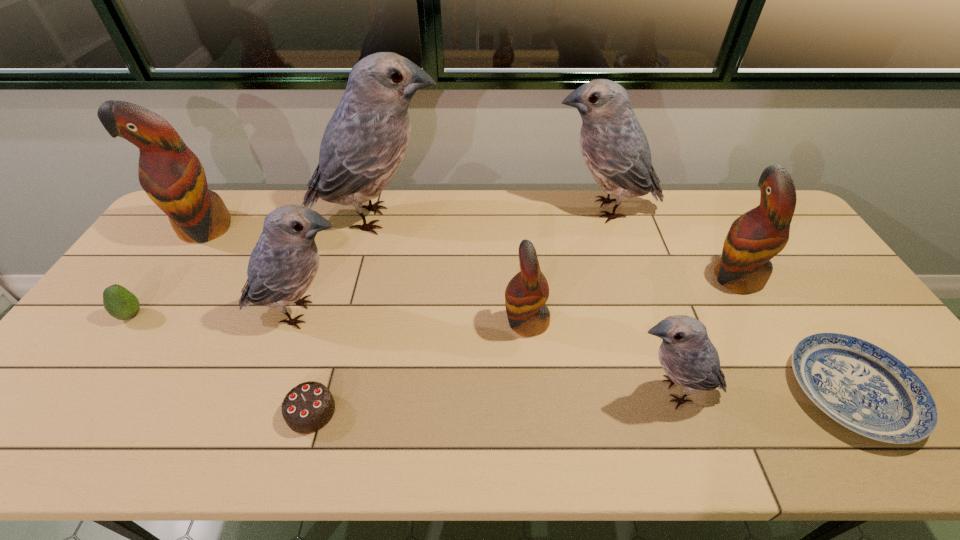
Where is `object located in the right edge section of the desktop`? Image resolution: width=960 pixels, height=540 pixels. object located in the right edge section of the desktop is located at coordinates (861, 386).

At what (x,y) coordinates should I click in order to perform the action: click on object located at the far left corner. Please return your answer as a coordinate pair (x, y). Image resolution: width=960 pixels, height=540 pixels. Looking at the image, I should click on point(173,177).

Find the location of a particular element. The width and height of the screenshot is (960, 540). object that is at the near right corner is located at coordinates (861, 386).

Find the location of `free region at the far edge of the desktop`. free region at the far edge of the desktop is located at coordinates (685, 190).

In the image, there is a desktop. In order to click on free space at the near edge in this screenshot , I will do `click(161, 429)`.

Where is `free spot at the left edge of the desktop`? free spot at the left edge of the desktop is located at coordinates (91, 386).

In the image, there is a desktop. Where is `vacant space at the far right corner`? The width and height of the screenshot is (960, 540). vacant space at the far right corner is located at coordinates (755, 195).

The height and width of the screenshot is (540, 960). I want to click on vacant region at the near right corner, so click(x=947, y=432).

Where is `vacant area that lies between the rightmost parrot and the tallest parrot`? This screenshot has height=540, width=960. vacant area that lies between the rightmost parrot and the tallest parrot is located at coordinates (556, 248).

Locate an element on the screen. The image size is (960, 540). vacant space that is in between the chocolate cake and the tallest parrot is located at coordinates (344, 315).